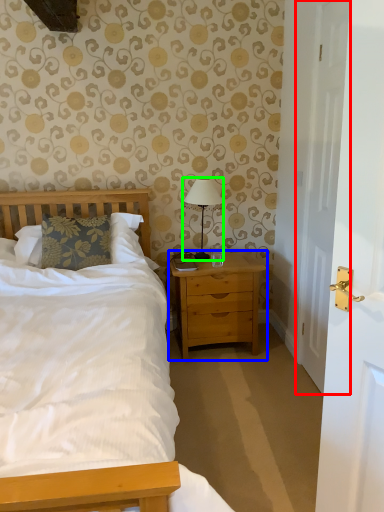
Question: Estimate the real-world distances between objects in this image. Which object is farther from door (highlighted by a red box), nightstand (highlighted by a blue box) or bedside lamp (highlighted by a green box)?

Choices:
 (A) nightstand
 (B) bedside lamp

Answer: (B)